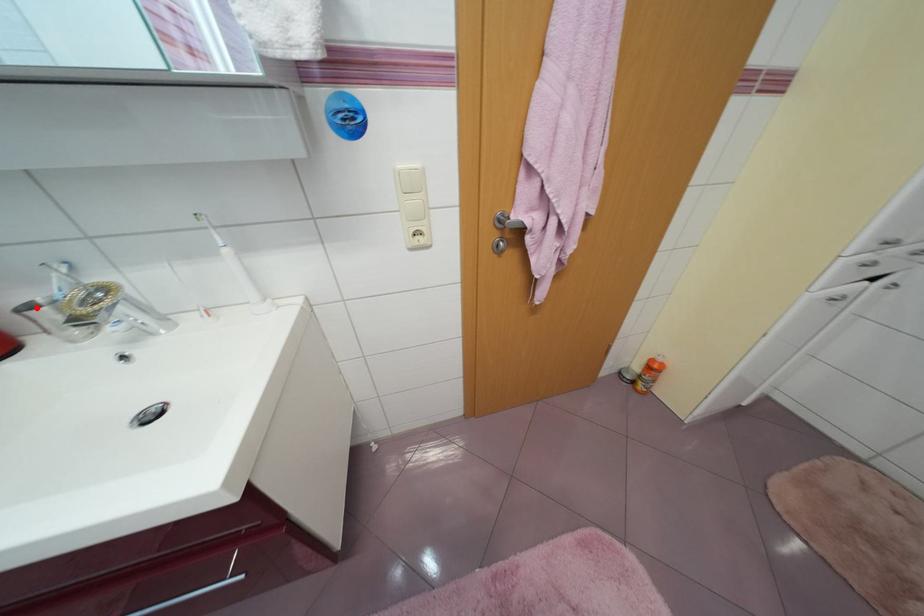
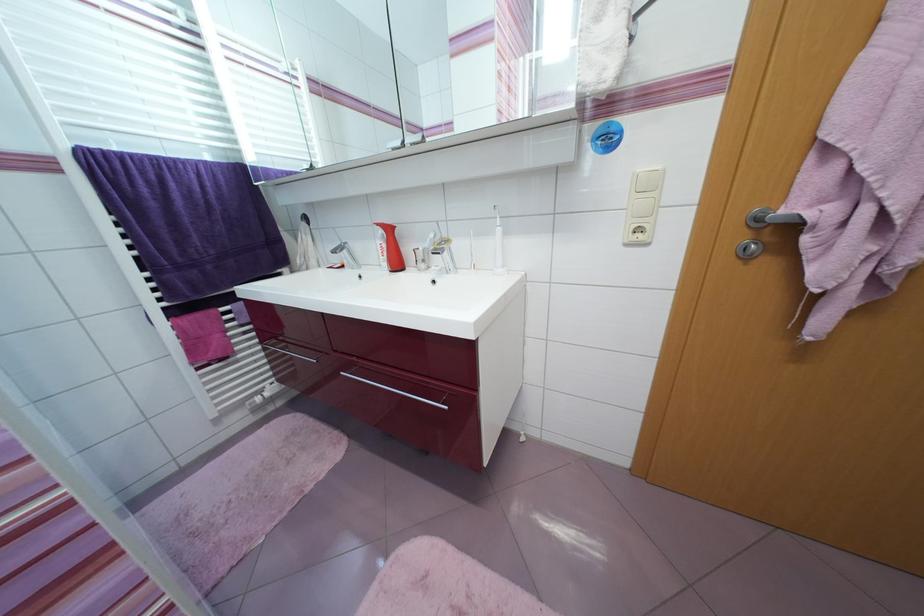
Question: I am providing you with two images of the same scene from different viewpoints. A red point is shown in image1. For the corresponding object point in image2, is it positioned nearer or farther from the camera?

Choices:
 (A) Nearer
 (B) Farther

Answer: (A)